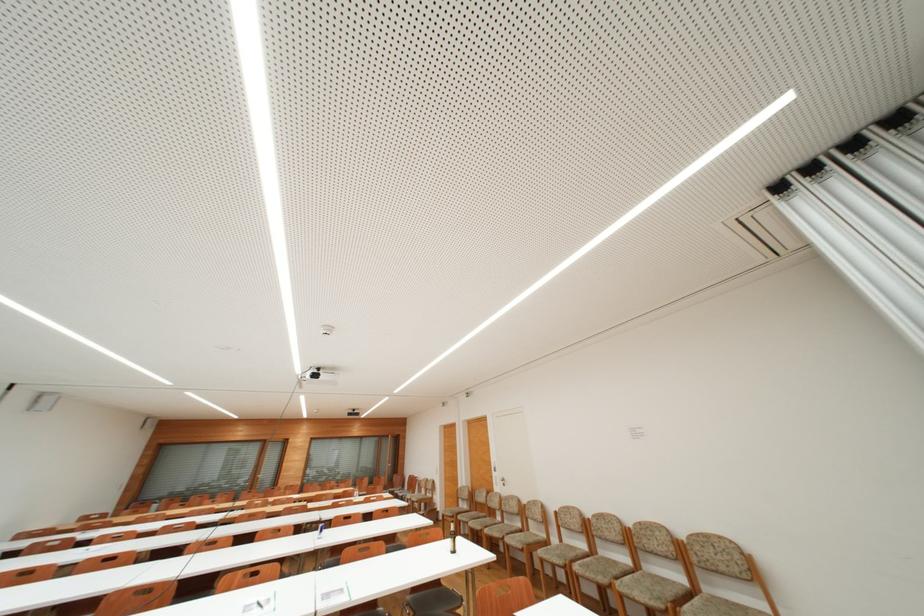
This screenshot has width=924, height=616. What do you see at coordinates (561, 551) in the screenshot?
I see `a wooden chair sitting surface` at bounding box center [561, 551].